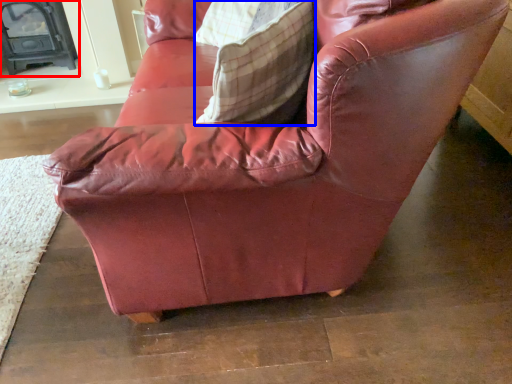
Question: Which object is closer to the camera taking this photo, fireplace (highlighted by a red box) or throw pillow (highlighted by a blue box)?

Choices:
 (A) fireplace
 (B) throw pillow

Answer: (B)